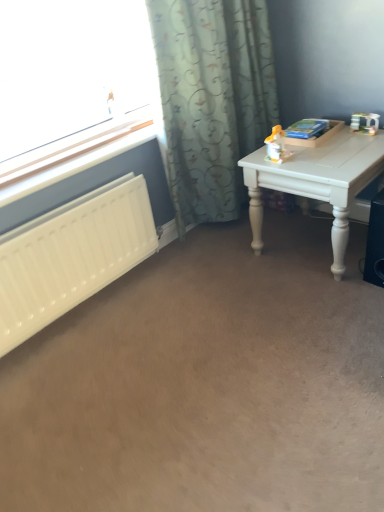
In order to click on spots to the right of yellow plastic toy at upper right in this screenshot , I will do `click(318, 156)`.